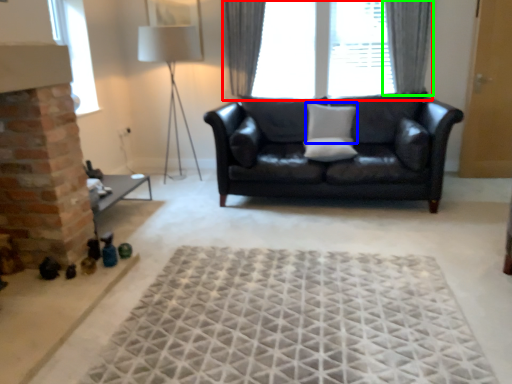
Question: Which is nearer to the window (highlighted by a red box)? pillow (highlighted by a blue box) or curtain (highlighted by a green box).

Choices:
 (A) pillow
 (B) curtain

Answer: (A)